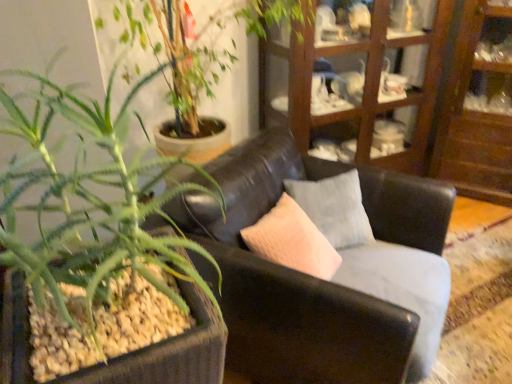
What do you see at coordinates (308, 275) in the screenshot? This screenshot has height=384, width=512. I see `black leather couch at center` at bounding box center [308, 275].

What do you see at coordinates (479, 106) in the screenshot?
I see `wooden cabinet at upper right` at bounding box center [479, 106].

The height and width of the screenshot is (384, 512). What do you see at coordinates (364, 86) in the screenshot?
I see `wooden cabinet at upper right` at bounding box center [364, 86].

In order to click on black leather couch at center in this screenshot , I will do `click(308, 275)`.

From a real-world perspective, is wooden cabinet at upper right under green succulent at left?

Yes, from a real-world perspective, wooden cabinet at upper right is below green succulent at left.

Choose the correct answer: Is wooden cabinet at upper right inside green succulent at left or outside it?

The correct answer is: outside.

In the image, is wooden cabinet at upper right positioned in front of or behind green succulent at left?

wooden cabinet at upper right is positioned farther from the viewer than green succulent at left.

Considering the relative positions of wooden cabinet at upper right and wooden cabinet at upper right in the image provided, is wooden cabinet at upper right to the right of wooden cabinet at upper right from the viewer's perspective?

Yes, wooden cabinet at upper right is to the right of wooden cabinet at upper right.

Is wooden cabinet at upper right thinner than wooden cabinet at upper right?

Indeed, wooden cabinet at upper right has a lesser width compared to wooden cabinet at upper right.

From a real-world perspective, is wooden cabinet at upper right positioned under wooden cabinet at upper right based on gravity?

Yes, from a real-world perspective, wooden cabinet at upper right is under wooden cabinet at upper right.

Would you say wooden cabinet at upper right is outside wooden cabinet at upper right?

Indeed, wooden cabinet at upper right is completely outside wooden cabinet at upper right.

Which is behind, green succulent at left or wooden cabinet at upper right?

wooden cabinet at upper right is more distant.

Does green succulent at left touch wooden cabinet at upper right?

No, green succulent at left is not next to wooden cabinet at upper right.

Locate an element on the screen. The height and width of the screenshot is (384, 512). houseplant positioned vertically above the wooden cabinet at upper right (from a real-world perspective) is located at coordinates (102, 174).

Considering the sizes of green succulent at left and wooden cabinet at upper right in the image, is green succulent at left bigger or smaller than wooden cabinet at upper right?

Considering their sizes, green succulent at left takes up less space than wooden cabinet at upper right.

Considering the positions of point (45, 239) and point (397, 363), is point (45, 239) closer or farther from the camera than point (397, 363)?

Clearly, point (45, 239) is closer to the camera than point (397, 363).

Locate an element on the screen. chair on the right of green succulent at left is located at coordinates (308, 275).

Is green succulent at left taller than black leather couch at center?

Yes, green succulent at left is taller than black leather couch at center.

Which is correct: wooden cabinet at upper right is inside wooden cabinet at upper right, or outside of it?

wooden cabinet at upper right is not inside wooden cabinet at upper right, it's outside.

Considering the relative positions of wooden cabinet at upper right and wooden cabinet at upper right in the image provided, is wooden cabinet at upper right to the right of wooden cabinet at upper right from the viewer's perspective?

No.

From the image's perspective, between wooden cabinet at upper right and wooden cabinet at upper right, which one is located above?

wooden cabinet at upper right is shown above in the image.

Is the surface of wooden cabinet at upper right in direct contact with wooden cabinet at upper right?

No, wooden cabinet at upper right is not touching wooden cabinet at upper right.

Is wooden cabinet at upper right further to the viewer compared to black leather couch at center?

Yes, wooden cabinet at upper right is further from the camera.

Is black leather couch at center at the back of wooden cabinet at upper right?

No, wooden cabinet at upper right is not facing away from black leather couch at center.

How many degrees apart are the facing directions of wooden cabinet at upper right and black leather couch at center?

87 degrees separate the facing orientations of wooden cabinet at upper right and black leather couch at center.

Would you say wooden cabinet at upper right is outside black leather couch at center?

Absolutely, wooden cabinet at upper right is external to black leather couch at center.

Measure the distance between wooden cabinet at upper right and black leather couch at center.

wooden cabinet at upper right and black leather couch at center are 36.43 inches apart from each other.

Which is more to the right, wooden cabinet at upper right or black leather couch at center?

Positioned to the right is wooden cabinet at upper right.

Between wooden cabinet at upper right and black leather couch at center, which one has smaller size?

With smaller size is wooden cabinet at upper right.

Which of these two, wooden cabinet at upper right or black leather couch at center, stands taller?

Standing taller between the two is wooden cabinet at upper right.

This screenshot has width=512, height=384. I want to click on houseplant located below the wooden cabinet at upper right (from the image's perspective), so click(102, 174).

At what (x,y) coordinates should I click in order to perform the action: click on cabinetry located above the wooden cabinet at upper right (from a real-world perspective). Please return your answer as a coordinate pair (x, y). The image size is (512, 384). Looking at the image, I should click on (364, 86).

Which object lies further to the anchor point green succulent at left, wooden cabinet at upper right or black leather couch at center?

The object further to green succulent at left is wooden cabinet at upper right.

When comparing their distances from black leather couch at center, does wooden cabinet at upper right or wooden cabinet at upper right seem further?

Among the two, wooden cabinet at upper right is located further to black leather couch at center.

Which object lies nearer to the anchor point green succulent at left, black leather couch at center or wooden cabinet at upper right?

black leather couch at center lies closer to green succulent at left than the other object.

Looking at the image, which one is located closer to wooden cabinet at upper right, green succulent at left or black leather couch at center?

The object closer to wooden cabinet at upper right is black leather couch at center.

When comparing their distances from wooden cabinet at upper right, does green succulent at left or wooden cabinet at upper right seem further?

green succulent at left lies further to wooden cabinet at upper right than the other object.

From the image, which object appears to be nearer to wooden cabinet at upper right, green succulent at left or black leather couch at center?

Among the two, black leather couch at center is located nearer to wooden cabinet at upper right.

Considering their positions, is black leather couch at center positioned closer to wooden cabinet at upper right than wooden cabinet at upper right?

wooden cabinet at upper right lies closer to wooden cabinet at upper right than the other object.

Looking at the image, which one is located closer to wooden cabinet at upper right, wooden cabinet at upper right or green succulent at left?

Based on the image, wooden cabinet at upper right appears to be nearer to wooden cabinet at upper right.

The image size is (512, 384). Identify the location of chair between green succulent at left and wooden cabinet at upper right from front to back. (308, 275).

Find the location of `cabinetry between green succulent at left and wooden cabinet at upper right along the z-axis`. cabinetry between green succulent at left and wooden cabinet at upper right along the z-axis is located at coordinates (364, 86).

Where is `cabinetry between black leather couch at center and wooden cabinet at upper right in the front-back direction`? This screenshot has width=512, height=384. cabinetry between black leather couch at center and wooden cabinet at upper right in the front-back direction is located at coordinates (364, 86).

The image size is (512, 384). Find the location of `chair positioned between green succulent at left and wooden cabinet at upper right from near to far`. chair positioned between green succulent at left and wooden cabinet at upper right from near to far is located at coordinates (308, 275).